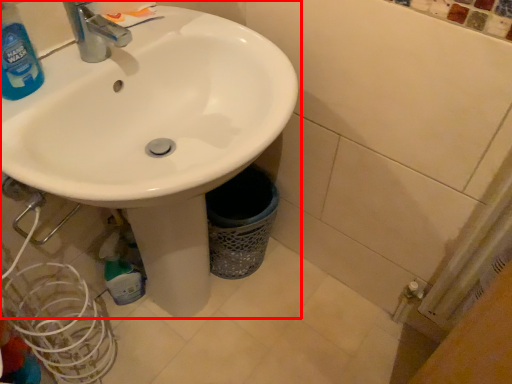
Question: In this image, where is sink (annotated by the red box) located relative to cleaning product?

Choices:
 (A) left
 (B) right

Answer: (B)